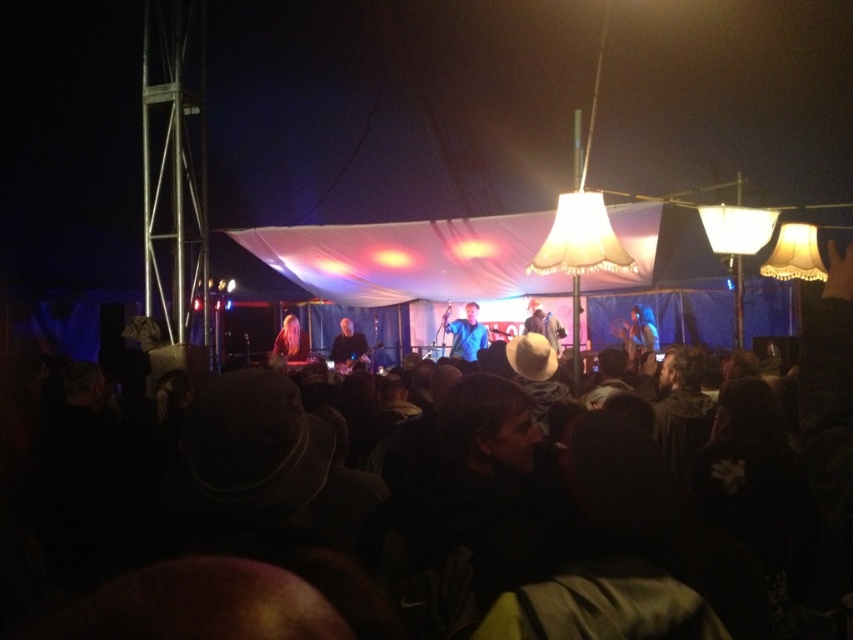
Question: Considering the real-world distances, which object is farthest from the blue fabric at center?

Choices:
 (A) blonde hair at center
 (B) white matte cowboy hat at center
 (C) smooth black guitar at center

Answer: (A)

Question: Estimate the real-world distances between objects in this image. Which object is farther from the smooth black guitar at center?

Choices:
 (A) shiny blue guitar at center
 (B) white matte cowboy hat at center

Answer: (A)

Question: Is blue fabric at center wider than blonde hair at center?

Choices:
 (A) no
 (B) yes

Answer: (B)

Question: Which object appears closest to the camera in this image?

Choices:
 (A) smooth black guitar at center
 (B) shiny blue guitar at center
 (C) blonde hair at center
 (D) white matte cowboy hat at center

Answer: (B)

Question: In this image, where is smooth black guitar at center located relative to shiny blue guitar at center?

Choices:
 (A) left
 (B) right

Answer: (A)

Question: Is blue fabric at center to the right of white matte cowboy hat at center from the viewer's perspective?

Choices:
 (A) no
 (B) yes

Answer: (A)